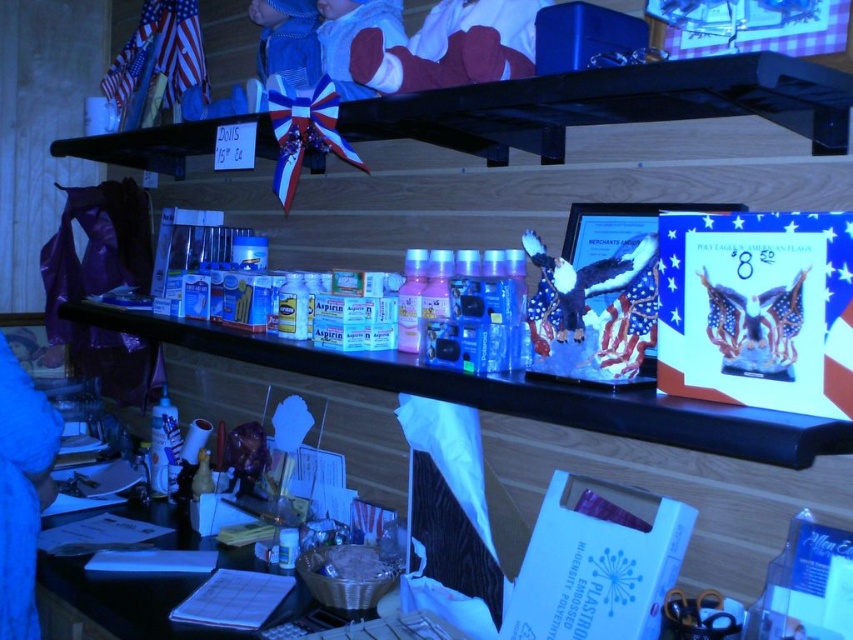
You are organizing the display shelf and need to place a new item between the soft cotton baby at upper center and the fuzzy fabric eagle at center. Given their widths, which item should be placed on the left to ensure the narrower item is on the right side?

The fuzzy fabric eagle at center should be placed on the right side because it is narrower than the soft cotton baby at upper center, allowing the narrower item to be positioned on the right.

Looking at this image, you are a customer in the store looking at the display shelf. You want to buy a gift for a newborn baby and also need something to place on a small table. Which item from the soft cotton baby at upper center and the fuzzy fabric eagle at center would be more suitable for the baby gift, and which one can fit on the small table?

The soft cotton baby at upper center is larger in size than the fuzzy fabric eagle at center. Therefore, the soft cotton baby at upper center would be more suitable as a baby gift due to its size, while the fuzzy fabric eagle at center can fit on the small table because it is smaller.

You are a customer looking at the display shelf. There is a soft cotton baby at upper center located at point (445, 48). Can you see the small American flag that is partially visible on the top shelf? Please explain your answer based on the objects and their positions.

The soft cotton baby at upper center is located at point (445, 48), which is on the top shelf where the small American flag is partially visible. Therefore, yes, the customer can see the small American flag on the top shelf.